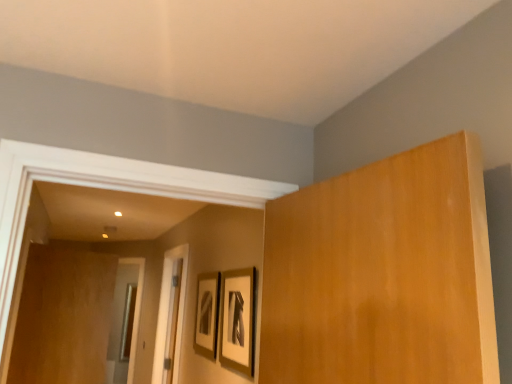
At what (x,y) coordinates should I click in order to perform the action: click on matte black picture frame at center, positioned as the 1th picture frame in front-to-back order. Please return your answer as a coordinate pair (x, y). The height and width of the screenshot is (384, 512). Looking at the image, I should click on (239, 319).

Consider the image. Which object is thinner, brown wood door at left or matte black picture frame at center, the 2th picture frame when ordered from back to front?

Thinner between the two is matte black picture frame at center, the 2th picture frame when ordered from back to front.

Would you say brown wood door at left contains matte black picture frame at center, which is the first picture frame from right to left?

No, matte black picture frame at center, which is the first picture frame from right to left, is located outside of brown wood door at left.

Is brown wood door at left far away from matte black picture frame at center, positioned as the 1th picture frame in front-to-back order?

brown wood door at left is far away from matte black picture frame at center, positioned as the 1th picture frame in front-to-back order.

Between point (63, 331) and point (195, 340), which one is positioned in front?

The point (195, 340) is in front.

Are brown wood door at left and matte black picture frame at center, marked as the 2th picture frame in a front-to-back arrangement, far apart?

Yes, brown wood door at left is far from matte black picture frame at center, marked as the 2th picture frame in a front-to-back arrangement.

What's the angular difference between brown wood door at left and matte black picture frame at center, marked as the 2th picture frame in a front-to-back arrangement,'s facing directions?

92.1 degrees separate the facing orientations of brown wood door at left and matte black picture frame at center, marked as the 2th picture frame in a front-to-back arrangement.

Is brown wood door at left taller or shorter than matte black picture frame at center, the first picture frame in the left-to-right sequence?

Clearly, brown wood door at left is taller compared to matte black picture frame at center, the first picture frame in the left-to-right sequence.

How different are the orientations of matte black picture frame at center, the 2th picture frame when ordered from right to left, and brown wood door at left in degrees?

There is a 92.1-degree angle between the facing directions of matte black picture frame at center, the 2th picture frame when ordered from right to left, and brown wood door at left.

From the image's perspective, is matte black picture frame at center, the 2th picture frame when ordered from right to left, located beneath brown wood door at left?

Actually, matte black picture frame at center, the 2th picture frame when ordered from right to left, appears above brown wood door at left in the image.

Is matte black picture frame at center, the first picture frame viewed from the back, further to camera compared to brown wood door at left?

No.

From a real-world perspective, which is physically below, matte black picture frame at center, marked as the 2th picture frame in a front-to-back arrangement, or brown wood door at left?

brown wood door at left.

Who is shorter, matte black picture frame at center, the 2th picture frame when ordered from back to front, or brown wood door at left?

With less height is matte black picture frame at center, the 2th picture frame when ordered from back to front.

Does matte black picture frame at center, positioned as the 1th picture frame in front-to-back order, have a lesser width compared to brown wood door at left?

Yes.

Considering the positions of objects matte black picture frame at center, positioned as the 1th picture frame in front-to-back order, and brown wood door at left in the image provided, who is more to the right, matte black picture frame at center, positioned as the 1th picture frame in front-to-back order, or brown wood door at left?

From the viewer's perspective, matte black picture frame at center, positioned as the 1th picture frame in front-to-back order, appears more on the right side.

Is matte black picture frame at center, the second picture frame viewed from the left, behind brown wood door at left?

No, it is in front of brown wood door at left.

Considering the relative positions of matte black picture frame at center, marked as the 2th picture frame in a front-to-back arrangement, and matte black picture frame at center, the 2th picture frame when ordered from back to front, in the image provided, is matte black picture frame at center, marked as the 2th picture frame in a front-to-back arrangement, in front of matte black picture frame at center, the 2th picture frame when ordered from back to front,?

No, the depth of matte black picture frame at center, marked as the 2th picture frame in a front-to-back arrangement, is greater than that of matte black picture frame at center, the 2th picture frame when ordered from back to front.

Looking at their sizes, would you say matte black picture frame at center, marked as the 2th picture frame in a front-to-back arrangement, is wider or thinner than matte black picture frame at center, the 2th picture frame when ordered from back to front?

Considering their sizes, matte black picture frame at center, marked as the 2th picture frame in a front-to-back arrangement, looks slimmer than matte black picture frame at center, the 2th picture frame when ordered from back to front.

Based on the photo, is matte black picture frame at center, marked as the 2th picture frame in a front-to-back arrangement, at the right side of matte black picture frame at center, the 2th picture frame when ordered from back to front?

No.

Are matte black picture frame at center, the second picture frame viewed from the left, and matte black picture frame at center, marked as the 2th picture frame in a front-to-back arrangement, located far from each other?

They are positioned close to each other.

Looking at this image, from a real-world perspective, who is located higher, matte black picture frame at center, which is the first picture frame from right to left, or matte black picture frame at center, the 2th picture frame when ordered from right to left?

From a 3D spatial view, matte black picture frame at center, which is the first picture frame from right to left, is above.

Consider the image. Is matte black picture frame at center, which is the first picture frame from right to left, positioned with its back to matte black picture frame at center, the first picture frame viewed from the back?

That's not correct — matte black picture frame at center, which is the first picture frame from right to left, is not looking away from matte black picture frame at center, the first picture frame viewed from the back.

Based on the photo, which object is wider, matte black picture frame at center, which is the first picture frame from right to left, or matte black picture frame at center, the 2th picture frame when ordered from right to left?

Wider between the two is matte black picture frame at center, which is the first picture frame from right to left.

Identify the location of the 2nd picture frame in front of the brown wood door at left, starting your count from the anchor. (239, 319).

From the brown wood door at left, count 1st picture frame to the right and point to it. Please provide its 2D coordinates.

[(207, 313)]

Based on their spatial positions, is matte black picture frame at center, the 2th picture frame when ordered from back to front, or brown wood door at left further from matte black picture frame at center, marked as the 2th picture frame in a front-to-back arrangement?

Among the two, brown wood door at left is located further to matte black picture frame at center, marked as the 2th picture frame in a front-to-back arrangement.

Considering their positions, is brown wood door at left positioned further to matte black picture frame at center, positioned as the 1th picture frame in front-to-back order, than matte black picture frame at center, the first picture frame viewed from the back?

brown wood door at left lies further to matte black picture frame at center, positioned as the 1th picture frame in front-to-back order, than the other object.

When comparing their distances from brown wood door at left, does matte black picture frame at center, the second picture frame viewed from the left, or matte black picture frame at center, the first picture frame viewed from the back, seem closer?

matte black picture frame at center, the first picture frame viewed from the back.

Based on their spatial positions, is brown wood door at left or matte black picture frame at center, the 2th picture frame when ordered from back to front, closer to matte black picture frame at center, the 2th picture frame when ordered from right to left?

Based on the image, matte black picture frame at center, the 2th picture frame when ordered from back to front, appears to be nearer to matte black picture frame at center, the 2th picture frame when ordered from right to left.

Which object lies further to the anchor point matte black picture frame at center, the 2th picture frame when ordered from back to front, matte black picture frame at center, the first picture frame in the left-to-right sequence, or brown wood door at left?

The object further to matte black picture frame at center, the 2th picture frame when ordered from back to front, is brown wood door at left.

From the image, which object appears to be nearer to brown wood door at left, matte black picture frame at center, the first picture frame in the left-to-right sequence, or matte black picture frame at center, the 2th picture frame when ordered from back to front?

matte black picture frame at center, the first picture frame in the left-to-right sequence.

Locate an element on the screen. picture frame between brown wood door at left and matte black picture frame at center, the 2th picture frame when ordered from back to front is located at coordinates (207, 313).